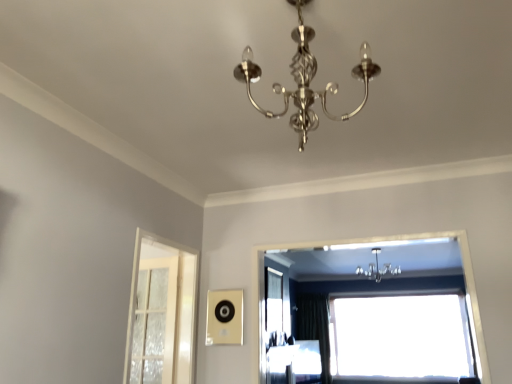
Question: Does shiny silver chandelier at center have a greater height compared to metallic chandelier at upper center?

Choices:
 (A) no
 (B) yes

Answer: (B)

Question: Does shiny silver chandelier at center appear on the left side of metallic chandelier at upper center?

Choices:
 (A) yes
 (B) no

Answer: (A)

Question: Can you see shiny silver chandelier at center touching metallic chandelier at upper center?

Choices:
 (A) yes
 (B) no

Answer: (B)

Question: Considering the relative sizes of shiny silver chandelier at center and metallic chandelier at upper center in the image provided, is shiny silver chandelier at center thinner than metallic chandelier at upper center?

Choices:
 (A) yes
 (B) no

Answer: (A)

Question: Is metallic chandelier at upper center at the back of shiny silver chandelier at center?

Choices:
 (A) no
 (B) yes

Answer: (A)

Question: Is shiny silver chandelier at center shorter than metallic chandelier at upper center?

Choices:
 (A) yes
 (B) no

Answer: (B)

Question: Considering the relative sizes of black velvet curtain at center and transparent glass window at upper center, marked as the first window in a right-to-left arrangement, in the image provided, is black velvet curtain at center thinner than transparent glass window at upper center, marked as the first window in a right-to-left arrangement,?

Choices:
 (A) yes
 (B) no

Answer: (A)

Question: From a real-world perspective, is black velvet curtain at center positioned over transparent glass window at upper center, positioned as the 1th window in back-to-front order, based on gravity?

Choices:
 (A) yes
 (B) no

Answer: (B)

Question: Can you confirm if black velvet curtain at center is shorter than transparent glass window at upper center, marked as the first window in a right-to-left arrangement?

Choices:
 (A) yes
 (B) no

Answer: (B)

Question: Is black velvet curtain at center further to the viewer compared to transparent glass window at upper center, the 2th window when ordered from top to bottom?

Choices:
 (A) no
 (B) yes

Answer: (B)

Question: Considering the relative sizes of black velvet curtain at center and transparent glass window at upper center, which is counted as the second window, starting from the front, in the image provided, is black velvet curtain at center wider than transparent glass window at upper center, which is counted as the second window, starting from the front,?

Choices:
 (A) yes
 (B) no

Answer: (B)

Question: Does black velvet curtain at center have a smaller size compared to transparent glass window at upper center, placed as the 1th window when sorted from bottom to top?

Choices:
 (A) no
 (B) yes

Answer: (B)

Question: Does shiny silver chandelier at center have a lesser width compared to transparent glass window at upper center, which is counted as the second window, starting from the front?

Choices:
 (A) no
 (B) yes

Answer: (A)